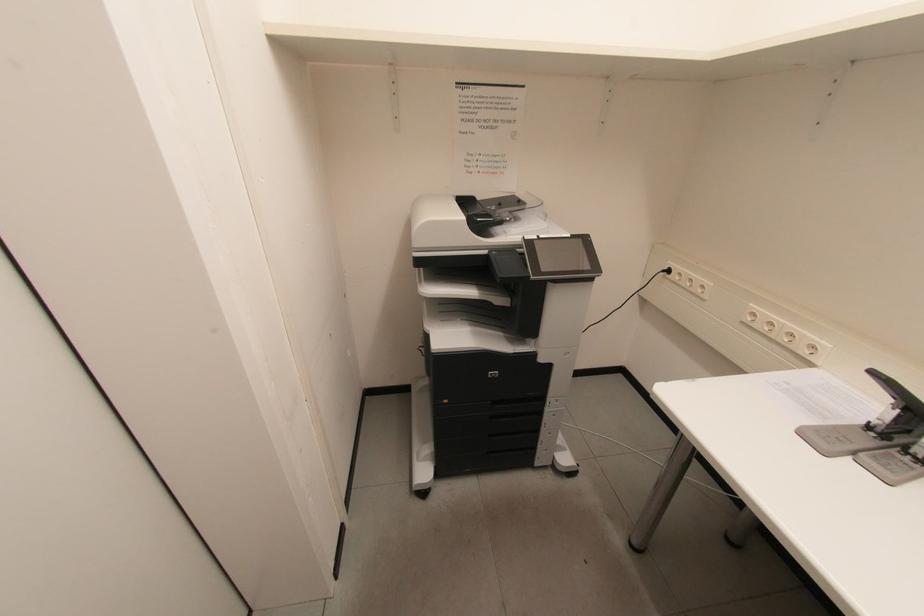
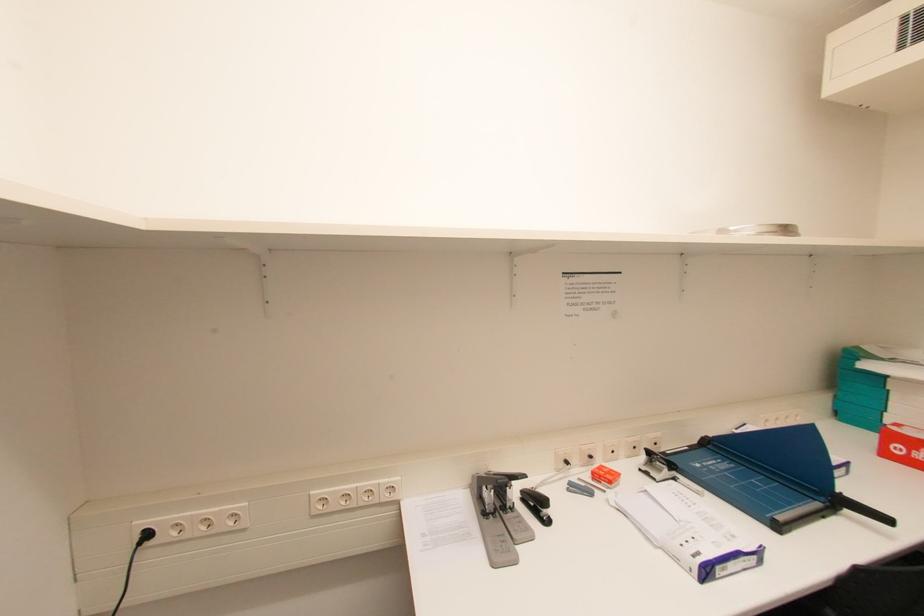
Question: Based on the continuous images, in which direction is the camera rotating? Reply with the corresponding letter.

Choices:
 (A) Left
 (B) Right
 (C) Up
 (D) Down

Answer: (B)